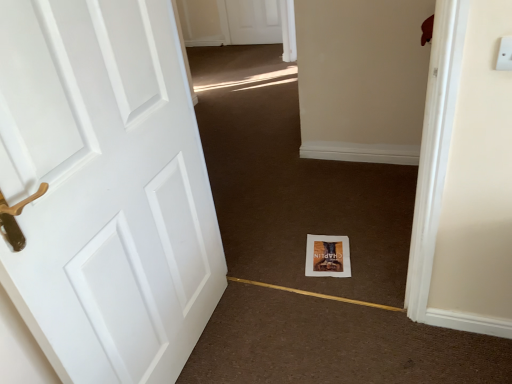
Question: Is white paper at center taller than white matte door at left?

Choices:
 (A) yes
 (B) no

Answer: (B)

Question: Is white paper at center bigger than white matte door at left?

Choices:
 (A) yes
 (B) no

Answer: (B)

Question: From a real-world perspective, does white paper at center stand above white matte door at left?

Choices:
 (A) yes
 (B) no

Answer: (B)

Question: Is white paper at center looking in the opposite direction of white matte door at left?

Choices:
 (A) no
 (B) yes

Answer: (A)

Question: Does white paper at center contain white matte door at left?

Choices:
 (A) yes
 (B) no

Answer: (B)

Question: From a real-world perspective, is white paper at center below white matte door at left?

Choices:
 (A) no
 (B) yes

Answer: (B)

Question: Is white matte door at left positioned with its back to matte paper book at center?

Choices:
 (A) yes
 (B) no

Answer: (B)

Question: Does white matte door at left have a lesser width compared to matte paper book at center?

Choices:
 (A) no
 (B) yes

Answer: (B)

Question: Can we say white matte door at left lies outside matte paper book at center?

Choices:
 (A) yes
 (B) no

Answer: (A)

Question: Is the depth of white matte door at left greater than that of matte paper book at center?

Choices:
 (A) yes
 (B) no

Answer: (B)

Question: Considering the relative sizes of white matte door at left and matte paper book at center in the image provided, is white matte door at left taller than matte paper book at center?

Choices:
 (A) yes
 (B) no

Answer: (A)

Question: Is the position of white matte door at left less distant than that of matte paper book at center?

Choices:
 (A) no
 (B) yes

Answer: (B)

Question: Is the depth of white paper at center greater than that of matte paper book at center?

Choices:
 (A) no
 (B) yes

Answer: (A)